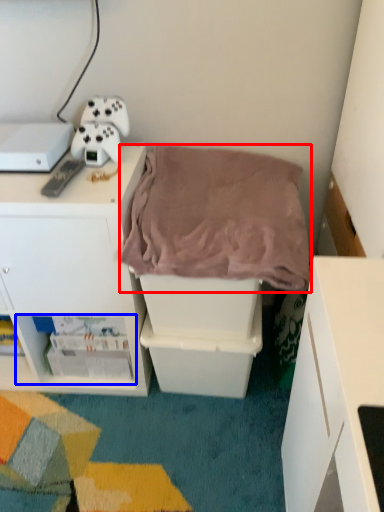
Question: Which object is closer to the camera taking this photo, blanket (highlighted by a red box) or shelf (highlighted by a blue box)?

Choices:
 (A) blanket
 (B) shelf

Answer: (A)